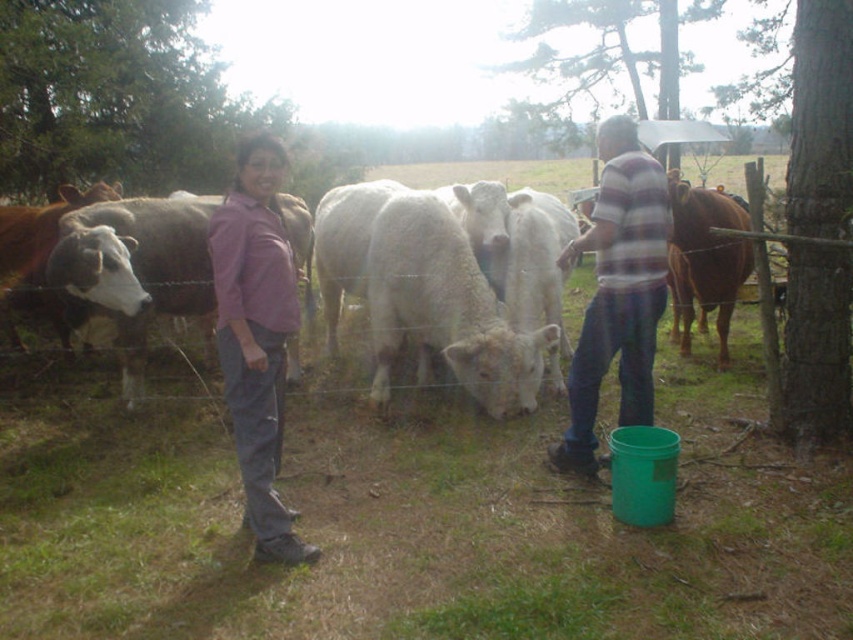
Question: Among these objects, which one is farthest from the camera?

Choices:
 (A) purple cotton shirt at center
 (B) brown glossy cow at right

Answer: (B)

Question: Is purple cotton shirt at center smaller than brown glossy cow at right?

Choices:
 (A) yes
 (B) no

Answer: (A)

Question: Can you confirm if purple cotton shirt at center is bigger than brown glossy cow at right?

Choices:
 (A) no
 (B) yes

Answer: (A)

Question: Is purple cotton shirt at center thinner than brown glossy cow at right?

Choices:
 (A) no
 (B) yes

Answer: (B)

Question: Which point is closer to the camera taking this photo?

Choices:
 (A) (231, 289)
 (B) (688, 208)

Answer: (A)